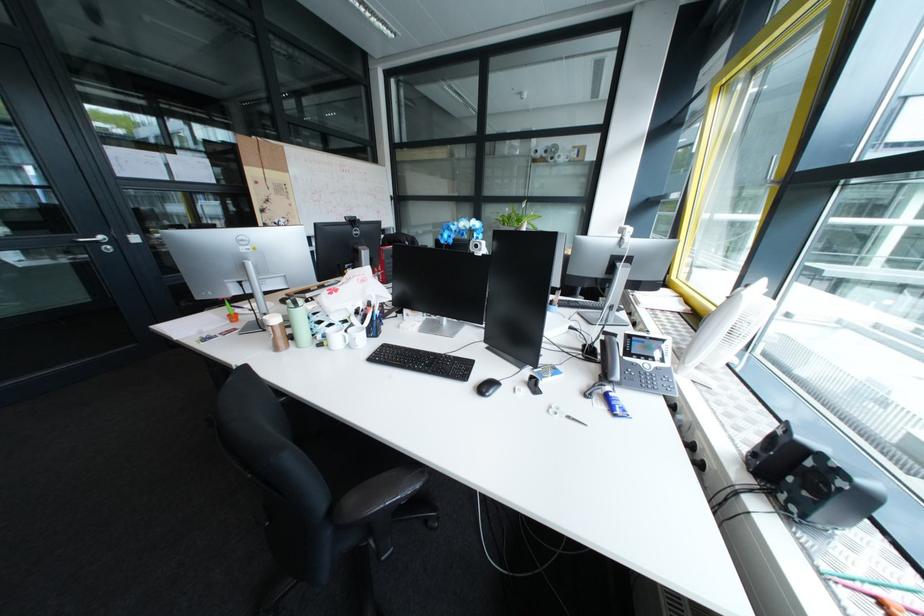
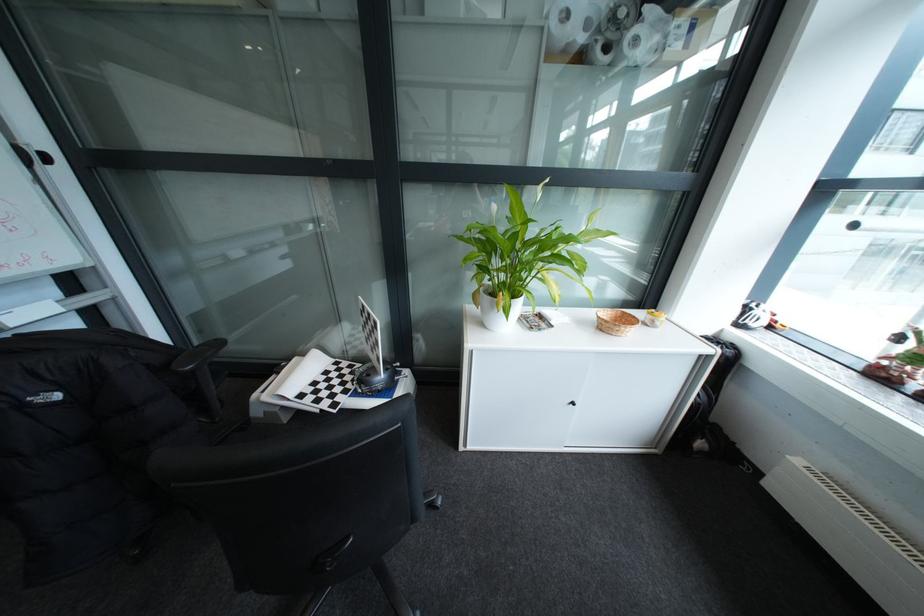
Question: The images are taken continuously from a first-person perspective. In which direction are you moving?

Choices:
 (A) Left
 (B) Right
 (C) Forward
 (D) Backward

Answer: (C)